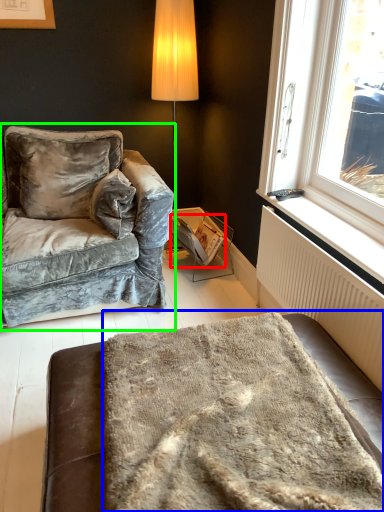
Question: Based on their relative distances, which object is farther from magazine (highlighted by a red box)? Choose from blanket (highlighted by a blue box) and studio couch (highlighted by a green box).

Choices:
 (A) blanket
 (B) studio couch

Answer: (A)